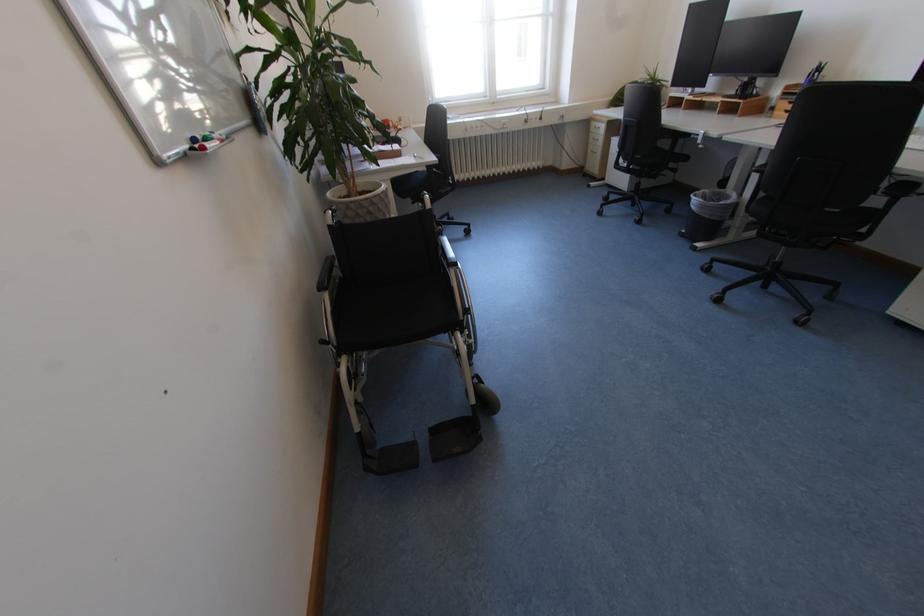
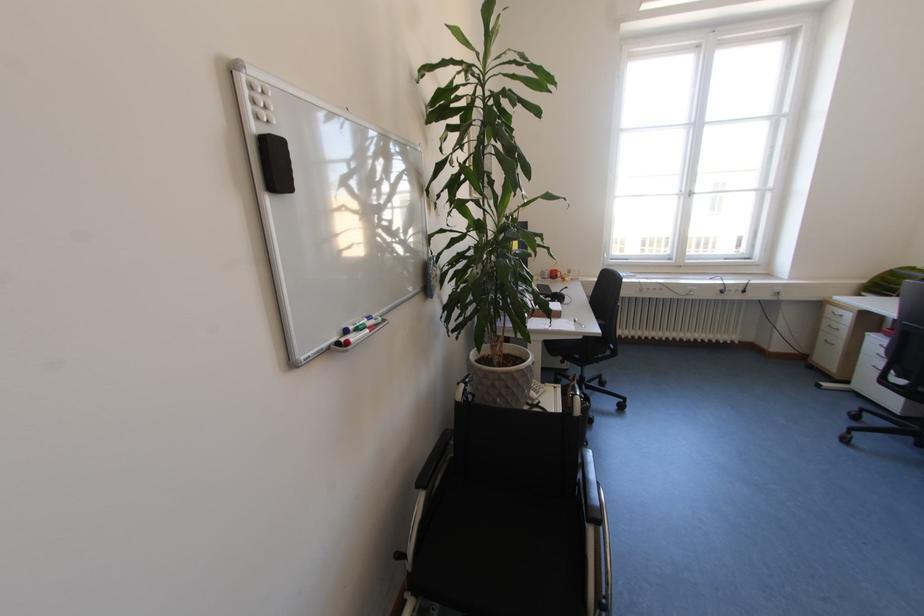
Where in the second image is the point corresponding to [601,130] from the first image?

(835, 315)